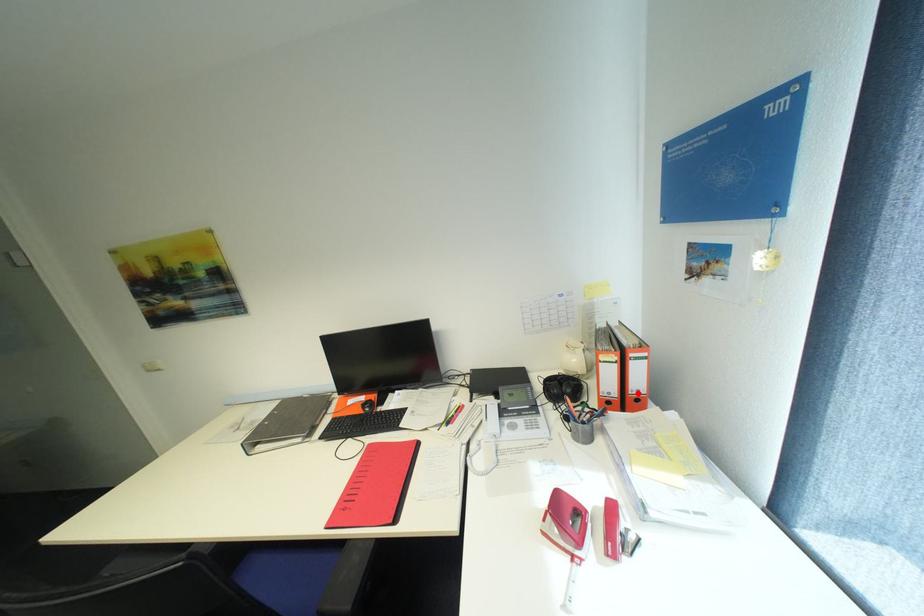
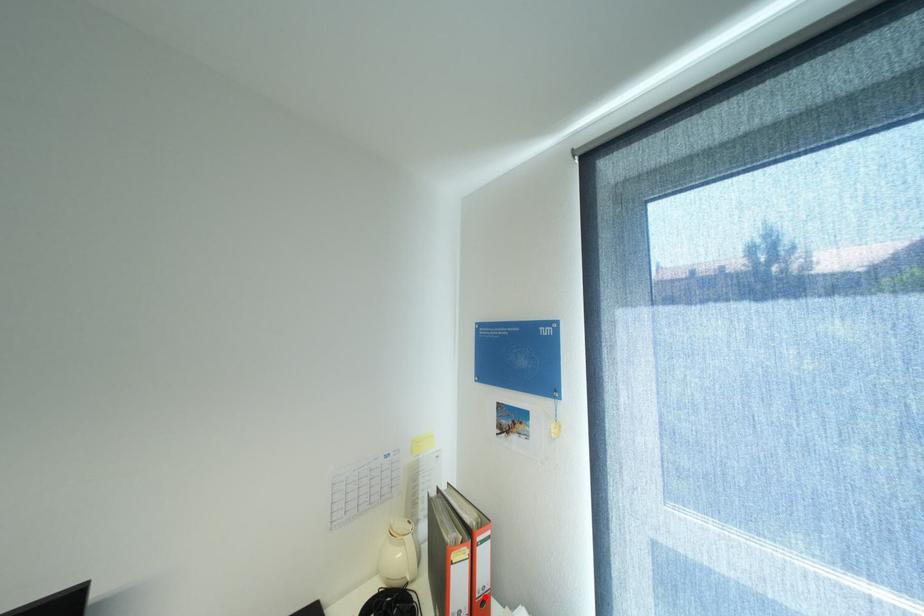
I am providing you with two images of the same scene from different viewpoints. A red point is marked on the first image and another point is marked on the second image. Are the points marked in image1 and image2 representing the same 3D position?

Yes